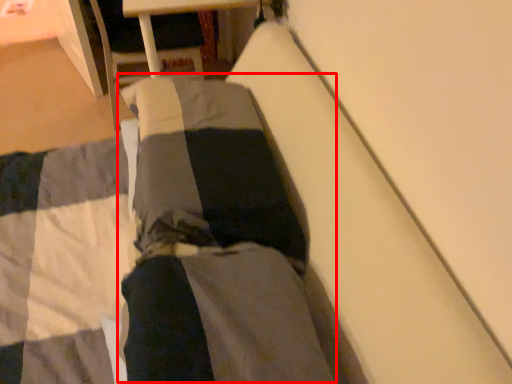
Question: Considering the relative positions of couple (annotated by the red box) and pants in the image provided, where is couple (annotated by the red box) located with respect to the staircase?

Choices:
 (A) right
 (B) left

Answer: (B)